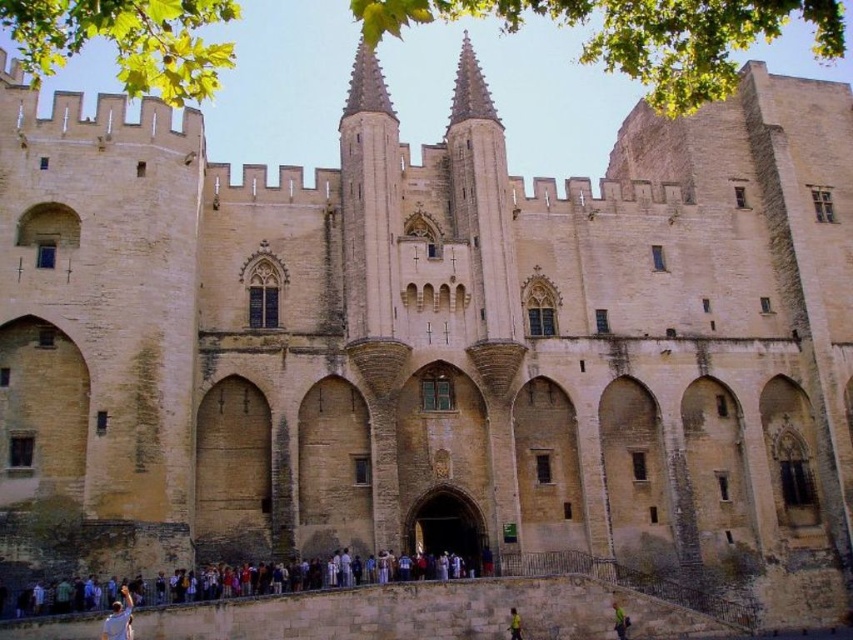
Looking at this image, which of these two, multicolored fabric crowd at lower center or light blue fabric at lower left, stands shorter?

Standing shorter between the two is light blue fabric at lower left.

Locate an element on the screen. multicolored fabric crowd at lower center is located at coordinates (299, 577).

What are the coordinates of `multicolored fabric crowd at lower center` in the screenshot? It's located at (299, 577).

Does light blue fabric at lower left have a larger size compared to yellow shirt at lower center?

Indeed, light blue fabric at lower left has a larger size compared to yellow shirt at lower center.

Can you confirm if light blue fabric at lower left is positioned above yellow shirt at lower center?

Yes, light blue fabric at lower left is above yellow shirt at lower center.

Locate an element on the screen. light blue fabric at lower left is located at coordinates click(x=119, y=618).

Is multicolored fabric crowd at lower center to the right of yellow shirt at lower center from the viewer's perspective?

No, multicolored fabric crowd at lower center is not to the right of yellow shirt at lower center.

At what (x,y) coordinates should I click in order to perform the action: click on multicolored fabric crowd at lower center. Please return your answer as a coordinate pair (x, y). Looking at the image, I should click on (299, 577).

You are a GUI agent. You are given a task and a screenshot of the screen. Output one action in this format:
    pyautogui.click(x=<x>, y=<y>)
    Task: Click on the multicolored fabric crowd at lower center
    This screenshot has height=640, width=853.
    Given the screenshot: What is the action you would take?
    pyautogui.click(x=299, y=577)

This screenshot has width=853, height=640. Identify the location of multicolored fabric crowd at lower center. (299, 577).